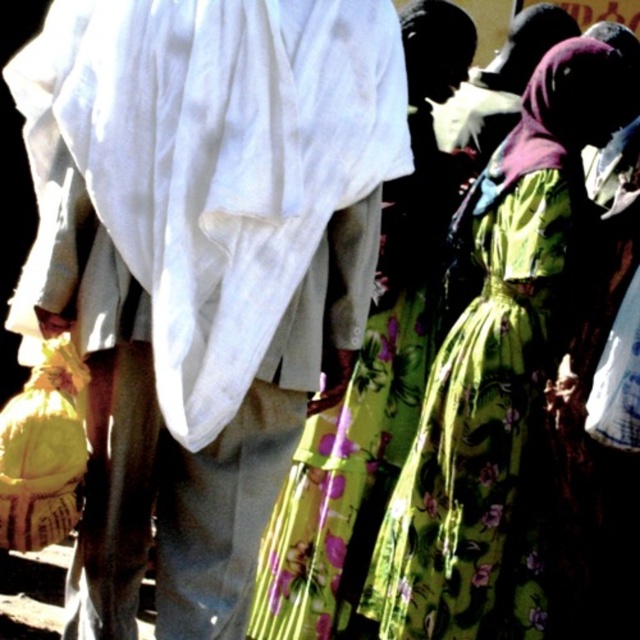
You are standing in the market and want to take a photo of both the person with the white garment and the individual in the bright green dress. Which of the two points, point A at coordinates point [93,444] or point B at coordinates point [291,620], should you focus on to ensure both subjects are in clear view?

→ You should focus on point A at coordinates point [93,444] because it is closer to the viewer than point B at coordinates point [291,620], ensuring both subjects are in clear view.

You are organizing a clothing display and need to arrange the white cotton cloth at center and the floral fabric dress at center on a rack. Which item should you place higher up to ensure both are visible?

The floral fabric dress at center should be placed higher up since the white cotton cloth at center is shorter in height, allowing both items to be visible on the rack.

You are organizing a fashion show and need to arrange two dresses in the center of the runway. The floral green dress at center and the floral fabric dress at center must be placed side by side. Which dress should be placed on the left to ensure they both fit within the 2.5 meter runway width?

The floral fabric dress at center should be placed on the left because its width is narrower than the floral green dress at center. This arrangement allows both dresses to fit within the 2.5 meter runway width as the total width would be less when the narrower dress is positioned first.